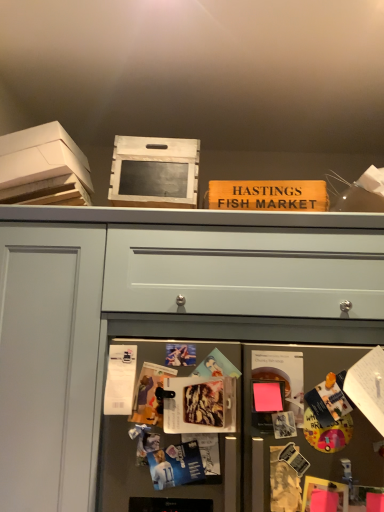
Question: From a real-world perspective, is matte plastic magazine at center, the 3th magazine when ordered from top to bottom, beneath metallic gray fridge at lower center?

Choices:
 (A) yes
 (B) no

Answer: (B)

Question: Is matte plastic magazine at center, the first magazine in the bottom-to-top sequence, closer to camera compared to metallic gray fridge at lower center?

Choices:
 (A) no
 (B) yes

Answer: (A)

Question: Does matte plastic magazine at center, the 3th magazine when ordered from top to bottom, appear on the left side of metallic gray fridge at lower center?

Choices:
 (A) yes
 (B) no

Answer: (A)

Question: From a real-world perspective, is matte plastic magazine at center, placed as the third magazine when sorted from back to front, physically above metallic gray fridge at lower center?

Choices:
 (A) yes
 (B) no

Answer: (A)

Question: Can you confirm if matte plastic magazine at center, the first magazine in the bottom-to-top sequence, is smaller than metallic gray fridge at lower center?

Choices:
 (A) no
 (B) yes

Answer: (B)

Question: Considering the positions of matte plastic magazine at center, the first magazine from the front, and white cardboard box at upper left in the image, is matte plastic magazine at center, the first magazine from the front, taller or shorter than white cardboard box at upper left?

Choices:
 (A) short
 (B) tall

Answer: (A)

Question: From a real-world perspective, is matte plastic magazine at center, the 3th magazine when ordered from top to bottom, physically located above or below white cardboard box at upper left?

Choices:
 (A) below
 (B) above

Answer: (A)

Question: From the image's perspective, is matte plastic magazine at center, the 3th magazine when ordered from top to bottom, located above or below white cardboard box at upper left?

Choices:
 (A) above
 (B) below

Answer: (B)

Question: Is matte plastic magazine at center, placed as the third magazine when sorted from back to front, bigger or smaller than white cardboard box at upper left?

Choices:
 (A) small
 (B) big

Answer: (A)

Question: Considering the positions of matte plastic magazine at center, the 3th magazine when ordered from top to bottom, and wooden crate at upper center in the image, is matte plastic magazine at center, the 3th magazine when ordered from top to bottom, wider or thinner than wooden crate at upper center?

Choices:
 (A) wide
 (B) thin

Answer: (B)

Question: Is point (210, 415) positioned closer to the camera than point (129, 148)?

Choices:
 (A) farther
 (B) closer

Answer: (B)

Question: Is matte plastic magazine at center, the first magazine in the bottom-to-top sequence, taller or shorter than wooden crate at upper center?

Choices:
 (A) short
 (B) tall

Answer: (A)

Question: From the image's perspective, is matte plastic magazine at center, placed as the third magazine when sorted from back to front, positioned above or below wooden crate at upper center?

Choices:
 (A) above
 (B) below

Answer: (B)

Question: In the image, is metallic gray fridge at lower center on the left side or the right side of white cardboard box at upper left?

Choices:
 (A) right
 (B) left

Answer: (A)

Question: Looking at their shapes, would you say metallic gray fridge at lower center is wider or thinner than white cardboard box at upper left?

Choices:
 (A) thin
 (B) wide

Answer: (A)